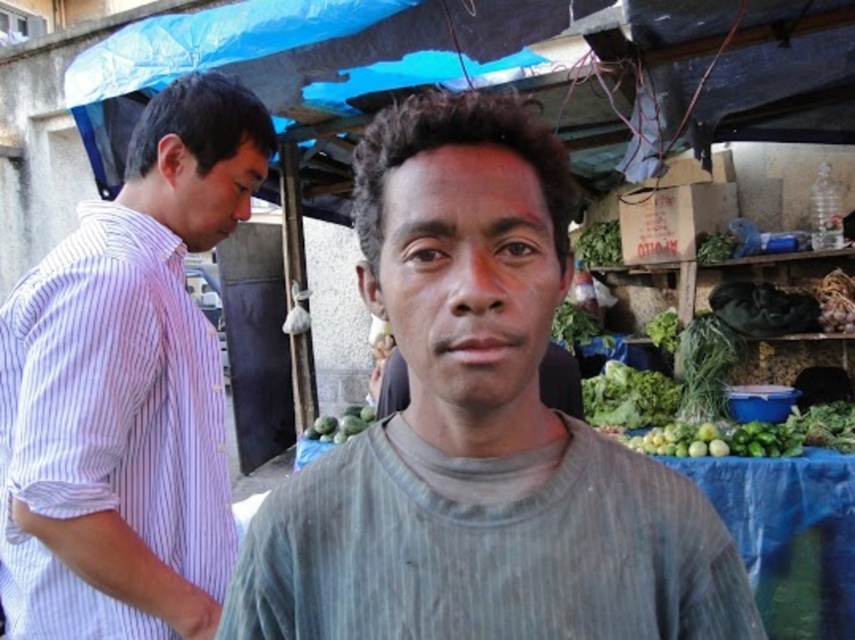
Can you confirm if dark curly hair at center is wider than green matte melon at center?

In fact, dark curly hair at center might be narrower than green matte melon at center.

Which is in front, point (535, 147) or point (340, 429)?

Point (535, 147) is more forward.

Between point (432, 120) and point (333, 429), which one is positioned in front?

Positioned in front is point (432, 120).

Where is `dark curly hair at center`? dark curly hair at center is located at coordinates (458, 145).

Does dark curly hair at center have a greater width compared to green leafy at right?

No.

Between dark curly hair at center and green leafy at right, which one is positioned lower?

green leafy at right

Who is more forward, [531,156] or [656,417]?

Point [531,156] is in front.

Where is `dark curly hair at center`? This screenshot has width=855, height=640. dark curly hair at center is located at coordinates (458, 145).

Where is `gray cotton shirt at center`? This screenshot has width=855, height=640. gray cotton shirt at center is located at coordinates (478, 429).

Measure the distance between point (240, 580) and camera.

A distance of 26.75 inches exists between point (240, 580) and camera.

Does point (529, 160) lie behind point (369, 228)?

No, it is not.

The image size is (855, 640). What are the coordinates of `gray cotton shirt at center` in the screenshot? It's located at (478, 429).